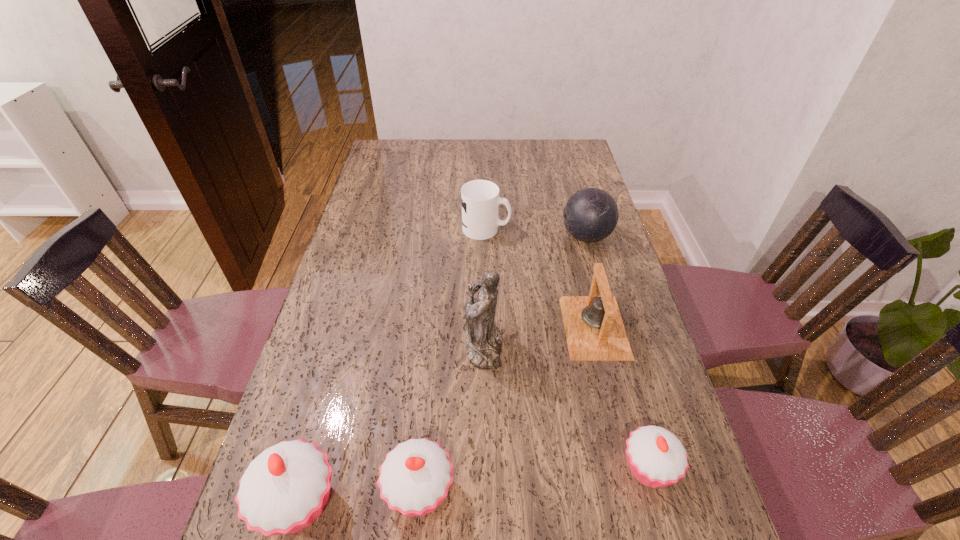
The width and height of the screenshot is (960, 540). Find the location of `object that is at the near right corner`. object that is at the near right corner is located at coordinates point(656,457).

I want to click on vacant space at the far edge of the desktop, so click(x=520, y=151).

The height and width of the screenshot is (540, 960). What are the coordinates of `blank area at the left edge` in the screenshot? It's located at (371, 211).

Where is `vacant area at the right edge`? vacant area at the right edge is located at coordinates (576, 173).

Find the location of a particular element. free space at the far left corner of the desktop is located at coordinates (408, 144).

Locate an element on the screen. vacant space at the far right corner of the desktop is located at coordinates (561, 166).

At what (x,y) coordinates should I click in order to perform the action: click on free space between the bell and the rightmost cupcake. Please return your answer as a coordinate pair (x, y). Looking at the image, I should click on (621, 397).

Locate an element on the screen. Image resolution: width=960 pixels, height=540 pixels. free spot between the tallest object and the bell is located at coordinates (539, 336).

Locate an element on the screen. This screenshot has height=540, width=960. free space that is in between the second cupcake from right to left and the bowling ball is located at coordinates (503, 363).

Image resolution: width=960 pixels, height=540 pixels. I want to click on vacant point located between the mug and the bell, so 540,278.